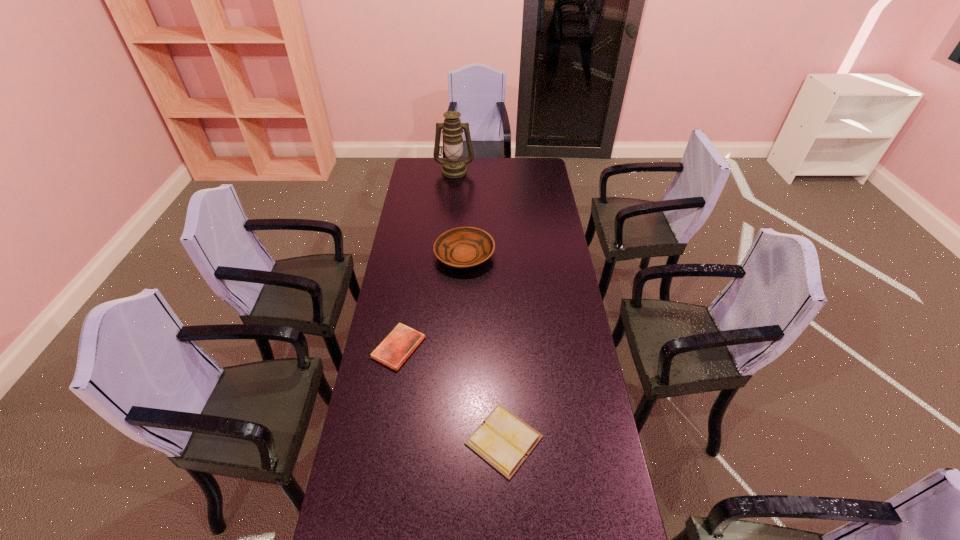
Locate an element on the screen. The height and width of the screenshot is (540, 960). the tallest object is located at coordinates (453, 167).

Image resolution: width=960 pixels, height=540 pixels. I want to click on oil lamp, so click(453, 167).

This screenshot has height=540, width=960. I want to click on the third shortest object, so click(463, 247).

Identify the location of the third nearest object. This screenshot has height=540, width=960. (463, 247).

Where is `the right diary`? The height and width of the screenshot is (540, 960). the right diary is located at coordinates (503, 440).

This screenshot has height=540, width=960. I want to click on the nearest object, so click(x=503, y=440).

I want to click on the farther diary, so click(x=400, y=343).

The image size is (960, 540). I want to click on the shortest object, so click(x=400, y=343).

In order to click on vacant region located on the back of the farthest object in this screenshot , I will do `click(455, 158)`.

The height and width of the screenshot is (540, 960). In order to click on blank area located on the back of the second farthest object in this screenshot , I will do `click(467, 206)`.